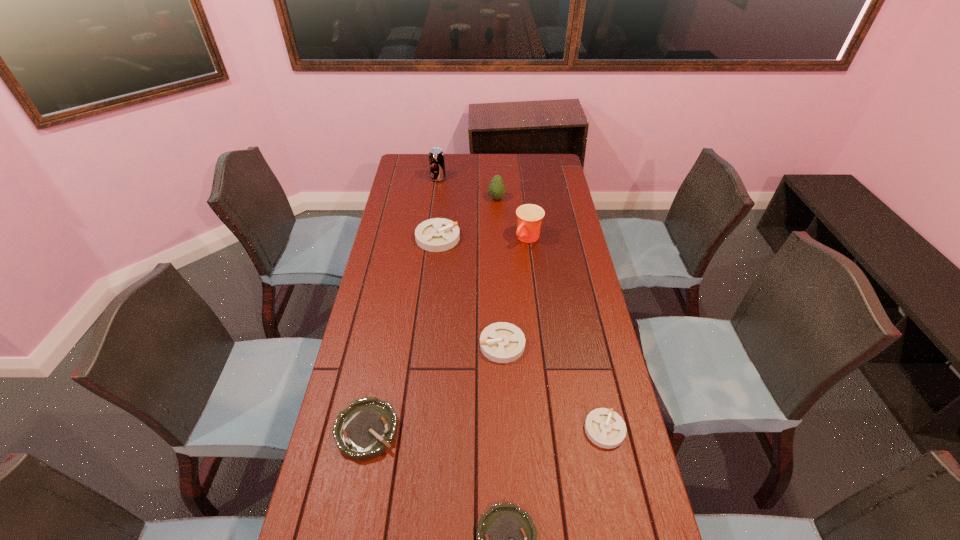
What are the coordinates of `the bigger green ashtray` in the screenshot? It's located at (368, 427).

I want to click on the rightmost gray ashtray, so click(605, 428).

Locate an element on the screen. the nearest gray ashtray is located at coordinates [x=605, y=428].

Where is `vacant space located on the front of the soda can`? vacant space located on the front of the soda can is located at coordinates (434, 213).

Where is `vacant space located 0.210m on the front of the cup`? vacant space located 0.210m on the front of the cup is located at coordinates (535, 288).

You are a GUI agent. You are given a task and a screenshot of the screen. Output one action in this format:
    pyautogui.click(x=<x>, y=<y>)
    Task: Click on the vacant area situated 0.220m on the left of the green avocado
    The width and height of the screenshot is (960, 540).
    Given the screenshot: What is the action you would take?
    pyautogui.click(x=440, y=198)

This screenshot has height=540, width=960. I want to click on blank space located on the left of the fifth shortest object, so coord(401,238).

Locate an element on the screen. Image resolution: width=960 pixels, height=540 pixels. free space located on the right of the second nearest gray ashtray is located at coordinates (563, 345).

The width and height of the screenshot is (960, 540). Identify the location of free region located 0.310m on the right of the left green ashtray. (513, 430).

Find the location of `free space located 0.260m on the back of the rightmost gray ashtray`. free space located 0.260m on the back of the rightmost gray ashtray is located at coordinates (585, 338).